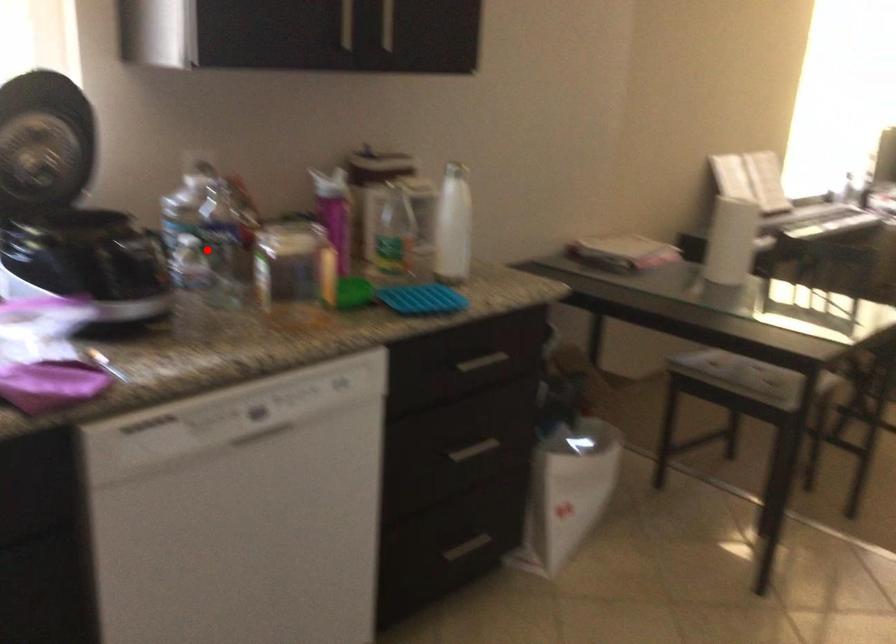
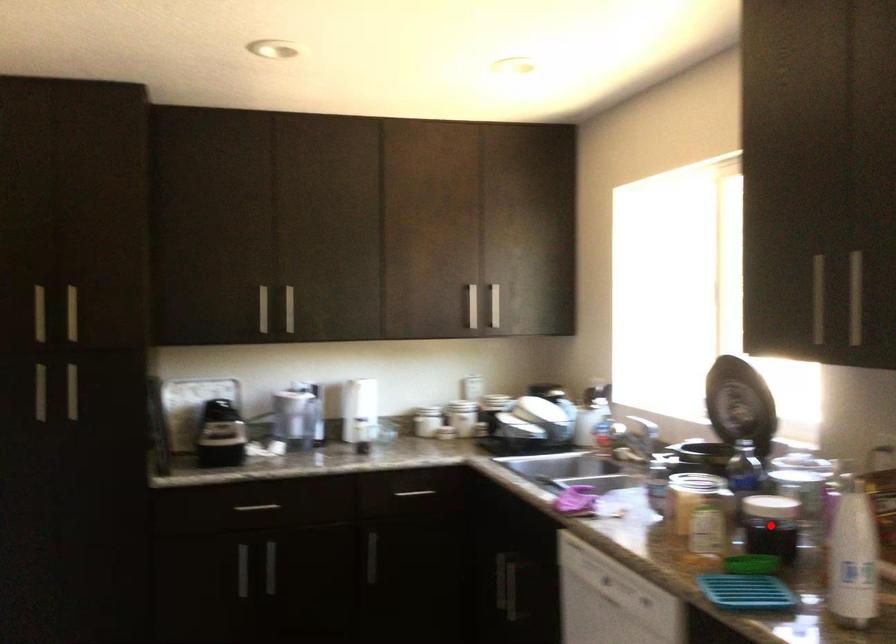
I am providing you with two images of the same scene from different viewpoints. A red point is marked on the first image and another point is marked on the second image. Are the points marked in image1 and image2 representing the same 3D position?

Yes